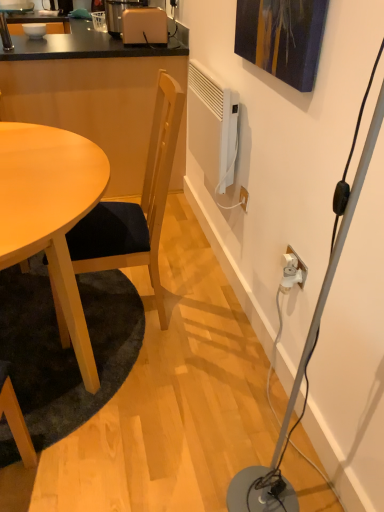
Identify the location of unoccupied region to the right of wooden chair at center. This screenshot has height=512, width=384. (213, 318).